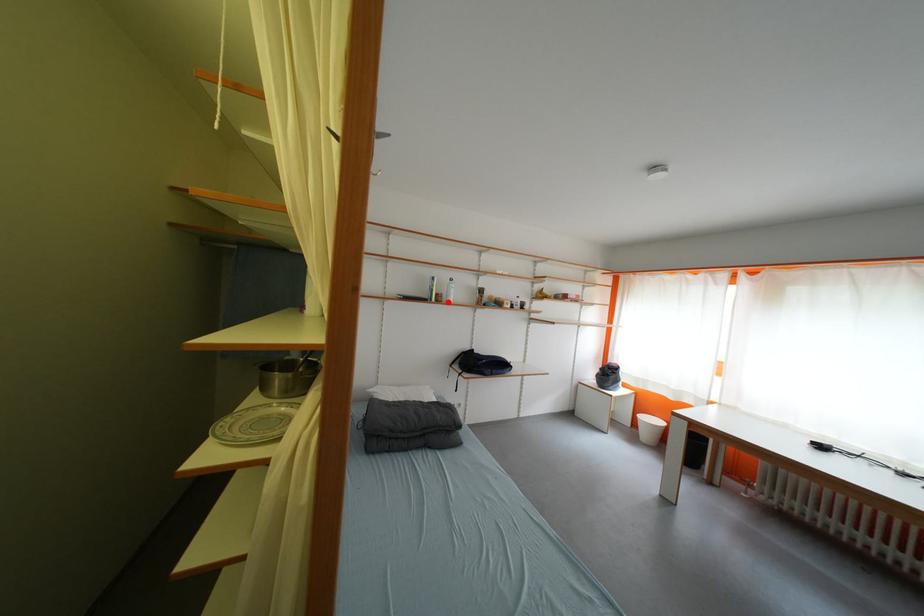
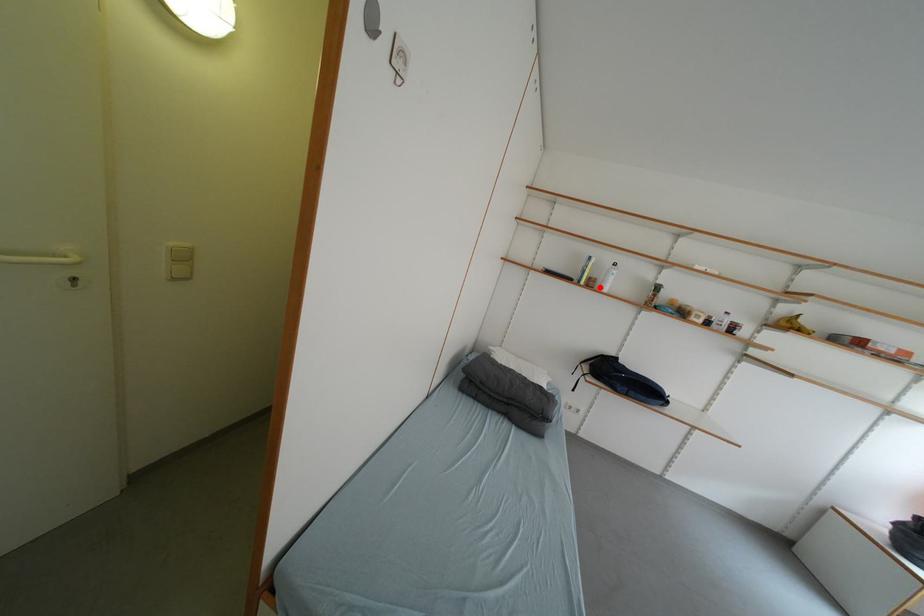
I am providing you with two images of the same scene from different viewpoints. A red point is marked on the first image and another point is marked on the second image. Does the point marked in image1 correspond to the same location as the one in image2?

Yes